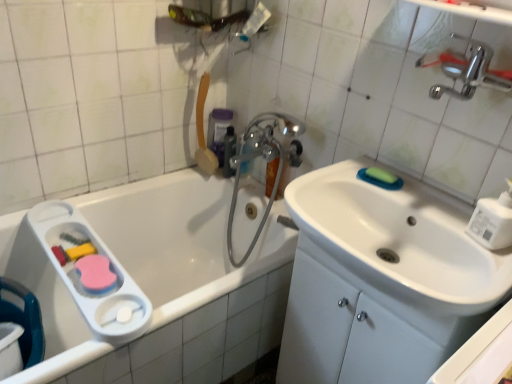
The width and height of the screenshot is (512, 384). What are the coordinates of `vacant space in between green matte soap at upper right and white plastic soap dispenser at right` in the screenshot? It's located at (424, 209).